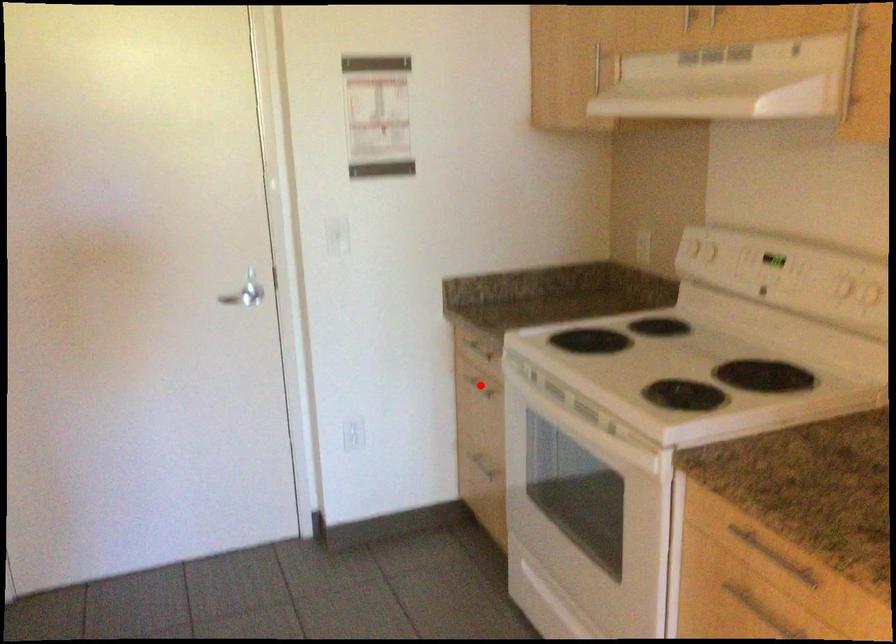
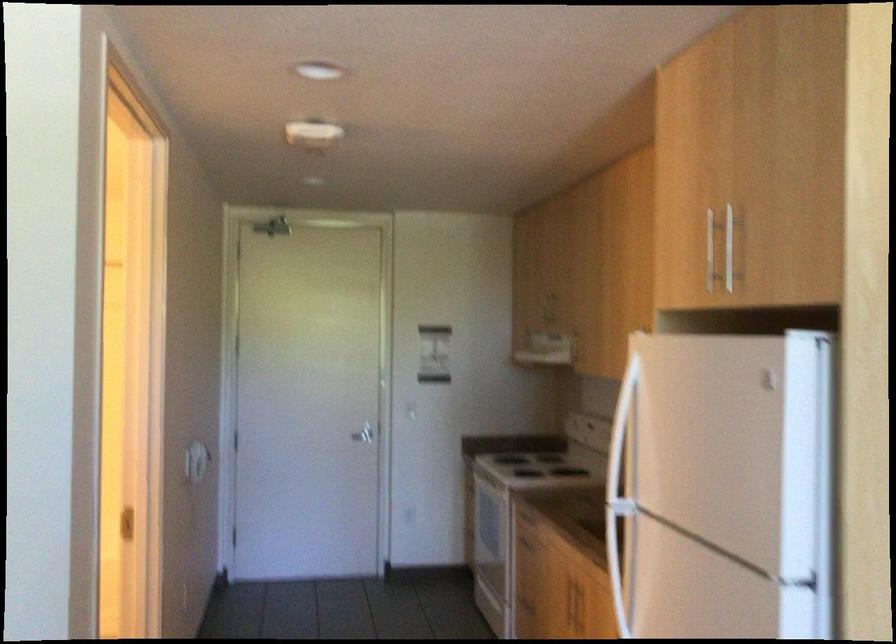
Question: I am providing you with two images of the same scene from different viewpoints. A red point is marked on the first image. Is the red point's position out of view in image 2?

Choices:
 (A) Yes
 (B) No

Answer: (A)